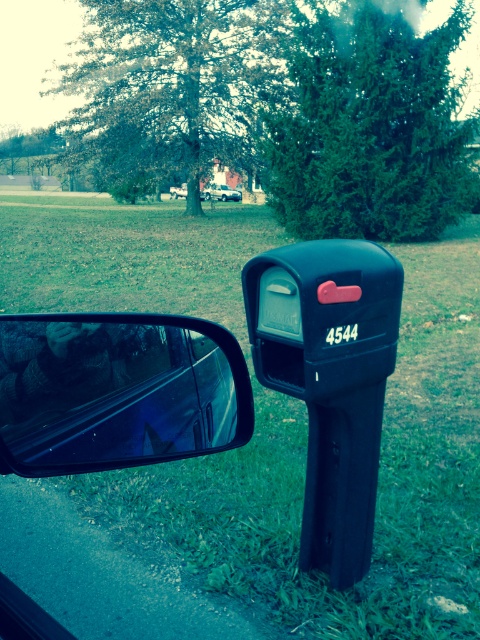
You are a passenger in a vehicle and notice two vehicles ahead on the road. The satin silver sedan at center and the metallic silver van at center. Which one is positioned higher in the image?

The satin silver sedan at center is positioned higher than the metallic silver van at center in the image.

You are sitting in the car and want to reach the black mailbox with the red flag. The car door is open. There is a point at coordinate (126, 332) which is 1.76 meters away from you. Can you safely step out of the car and walk to the mailbox without crossing that point?

The point at (126, 332) is 1.76 meters away from you. Since the mailbox is beside the road and the point is likely on the path, you should check if stepping out and walking to the mailbox would cross this point. If the point is part of the safe path, then yes, but if it indicates an obstacle or danger, avoid it. However, without additional context about the point, it is safer to assume caution.